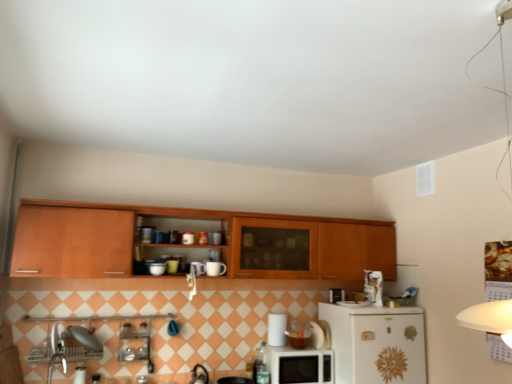
Question: Is white glossy refrigerator at lower right wider or thinner than white glossy microwave at center?

Choices:
 (A) wide
 (B) thin

Answer: (A)

Question: From a real-world perspective, is white glossy refrigerator at lower right physically located above or below white glossy microwave at center?

Choices:
 (A) above
 (B) below

Answer: (B)

Question: Considering the real-world distances, which object is closest to the white glossy refrigerator at lower right?

Choices:
 (A) white glossy microwave at lower center
 (B) wooden cabinet at upper center
 (C) white glossy microwave at center

Answer: (A)

Question: Based on their relative distances, which object is farther from the wooden cabinet at upper center?

Choices:
 (A) white glossy microwave at center
 (B) white glossy microwave at lower center
 (C) white glossy refrigerator at lower right

Answer: (A)